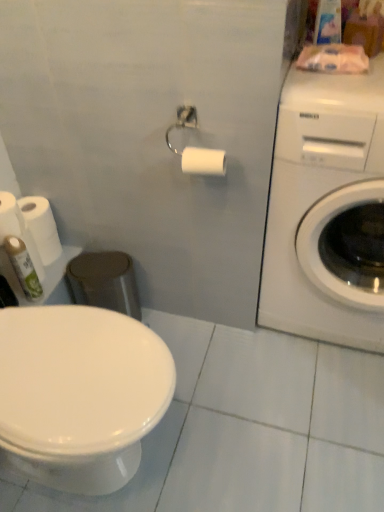
Question: Is white glossy toilet at lower left situated inside white matte toilet paper at upper center, the fourth toilet paper when ordered from back to front, or outside?

Choices:
 (A) inside
 (B) outside

Answer: (B)

Question: Would you say white glossy toilet at lower left is to the left or to the right of white matte toilet paper at upper center, the fourth toilet paper when ordered from back to front, in the picture?

Choices:
 (A) left
 (B) right

Answer: (A)

Question: Which object is the closest to the white matte toilet paper at left, which appears as the third toilet paper when viewed from the back?

Choices:
 (A) white glossy washing machine at upper right
 (B) green matte spray can at lower left
 (C) white glossy toilet at lower left
 (D) white matte toilet paper at left, which is counted as the second toilet paper, starting from the left
 (E) white matte toilet paper at left, the first toilet paper from the back

Answer: (D)

Question: Which is farther from the white matte toilet paper at upper center, the fourth toilet paper when ordered from back to front?

Choices:
 (A) white glossy washing machine at upper right
 (B) white matte toilet paper at left, which is counted as the second toilet paper, starting from the left
 (C) white glossy toilet at lower left
 (D) white matte toilet paper at left, the fourth toilet paper viewed from the right
 (E) white matte toilet paper at left, the first toilet paper from the back

Answer: (C)